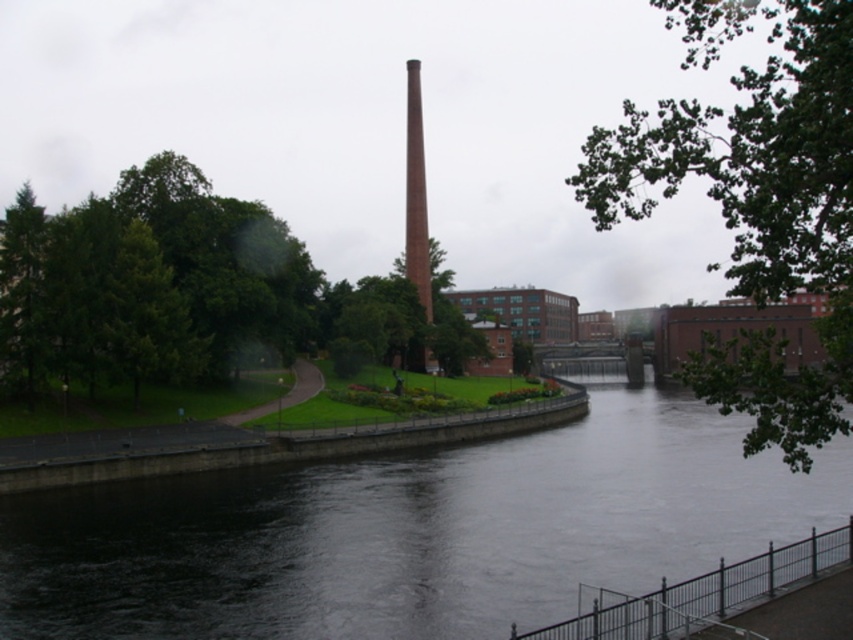
You are a landscape architect designing a new walking path between the dark gray concrete river at center and the green leafy tree at center. The path must be straight and 1 meter wide. Can the path be placed directly between them without any obstacles?

The dark gray concrete river at center and green leafy tree at center are 30.76 meters apart from each other. Since the path is 1 meter wide and straight, there is sufficient space to place it directly between them without any obstacles.

You are a photographer wanting to capture the red brick chimney at center without any obstructions. You notice the green leafy tree at upper right in your shot. What should you do to ensure the chimney is fully visible?

Move your position so that the green leafy tree at upper right is no longer blocking the view of the red brick chimney at center. Since the tree is in front of the chimney, adjusting your angle or moving to a different spot will allow you to frame the chimney without the tree obstructing it.

You are standing at the riverside and looking at two points marked in the image. The first point is at coordinates point (x=201, y=250) and the second point is at point (x=780, y=408). Which point is closer to you?

Point (x=201, y=250) is further to the camera than point (x=780, y=408). Therefore, point (x=780, y=408) is closer to you.